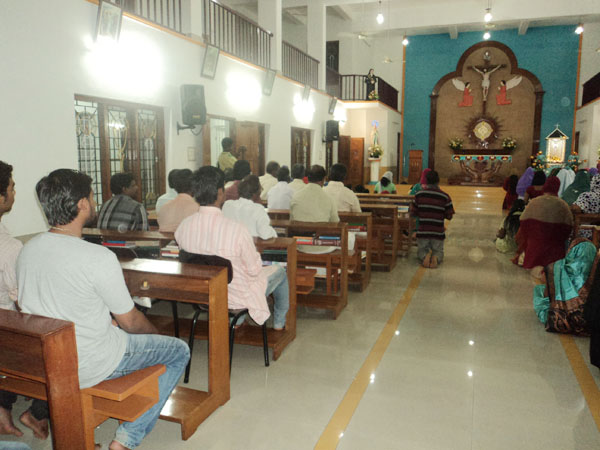
Identify the location of door. The width and height of the screenshot is (600, 450). (95, 131), (118, 138), (149, 146), (245, 133), (218, 135), (304, 156), (341, 157), (398, 156).